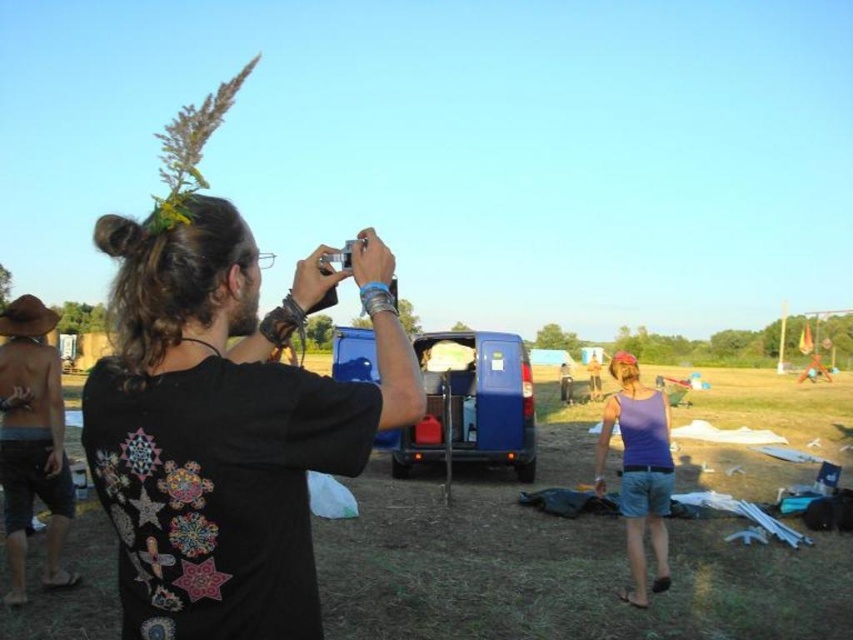
Question: From the image, what is the correct spatial relationship of black matte t-shirt at center in relation to brown straw hat at left?

Choices:
 (A) above
 (B) below

Answer: (A)

Question: Which point is closer to the camera taking this photo?

Choices:
 (A) (294, 588)
 (B) (662, 499)
 (C) (48, 403)

Answer: (A)

Question: Can you confirm if black matte t-shirt at center is positioned to the left of brown straw hat at left?

Choices:
 (A) yes
 (B) no

Answer: (B)

Question: Which object appears closest to the camera in this image?

Choices:
 (A) black matte t-shirt at center
 (B) purple cotton tank top at lower right
 (C) brown straw hat at left

Answer: (A)

Question: Which of these objects is positioned closest to the black matte t-shirt at center?

Choices:
 (A) purple cotton tank top at lower right
 (B) brown straw hat at left

Answer: (B)

Question: Is brown straw hat at left positioned before purple cotton tank top at lower right?

Choices:
 (A) yes
 (B) no

Answer: (A)